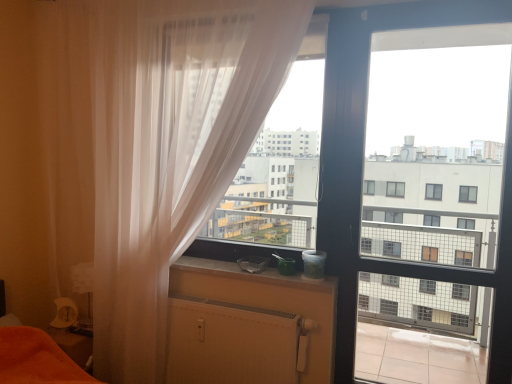
Question: From the image's perspective, would you say transparent glass screen door at center is shown under translucent white curtain at left?

Choices:
 (A) no
 (B) yes

Answer: (B)

Question: From a real-world perspective, is transparent glass screen door at center beneath translucent white curtain at left?

Choices:
 (A) no
 (B) yes

Answer: (A)

Question: Considering the relative positions of transparent glass screen door at center and translucent white curtain at left in the image provided, is transparent glass screen door at center behind translucent white curtain at left?

Choices:
 (A) yes
 (B) no

Answer: (A)

Question: Is transparent glass screen door at center to the left of translucent white curtain at left from the viewer's perspective?

Choices:
 (A) yes
 (B) no

Answer: (B)

Question: Is transparent glass screen door at center beside translucent white curtain at left?

Choices:
 (A) no
 (B) yes

Answer: (A)

Question: Could translucent white curtain at left be considered to be inside transparent glass screen door at center?

Choices:
 (A) no
 (B) yes

Answer: (A)

Question: Is the depth of translucent white curtain at left less than that of transparent glass screen door at center?

Choices:
 (A) no
 (B) yes

Answer: (B)

Question: Is translucent white curtain at left taller than transparent glass screen door at center?

Choices:
 (A) yes
 (B) no

Answer: (A)

Question: Is translucent white curtain at left aimed at transparent glass screen door at center?

Choices:
 (A) yes
 (B) no

Answer: (B)

Question: From a real-world perspective, is translucent white curtain at left on transparent glass screen door at center?

Choices:
 (A) no
 (B) yes

Answer: (A)

Question: Can you confirm if translucent white curtain at left is wider than transparent glass screen door at center?

Choices:
 (A) no
 (B) yes

Answer: (B)

Question: Is translucent white curtain at left oriented away from transparent glass screen door at center?

Choices:
 (A) no
 (B) yes

Answer: (A)

Question: From a real-world perspective, is white matte radiator at lower center beneath smooth concrete window sill at center?

Choices:
 (A) no
 (B) yes

Answer: (B)